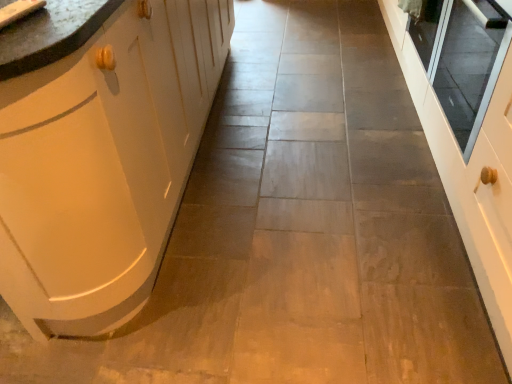
Question: Relative to transparent glass door at right, is matte white cabinet at left in front or behind?

Choices:
 (A) behind
 (B) front

Answer: (B)

Question: From the image's perspective, is matte white cabinet at left located above or below transparent glass door at right?

Choices:
 (A) below
 (B) above

Answer: (B)

Question: Based on their relative distances, which object is farther from the matte white cabinet at left?

Choices:
 (A) matte white sink at upper left
 (B) transparent glass door at right

Answer: (B)

Question: Which of these objects is positioned closest to the matte white cabinet at left?

Choices:
 (A) matte white sink at upper left
 (B) transparent glass door at right

Answer: (A)